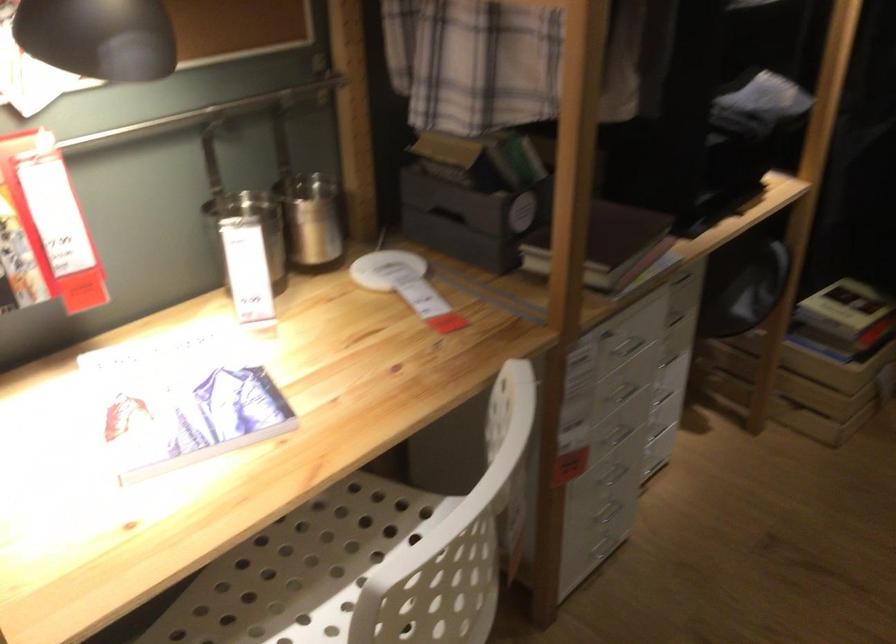
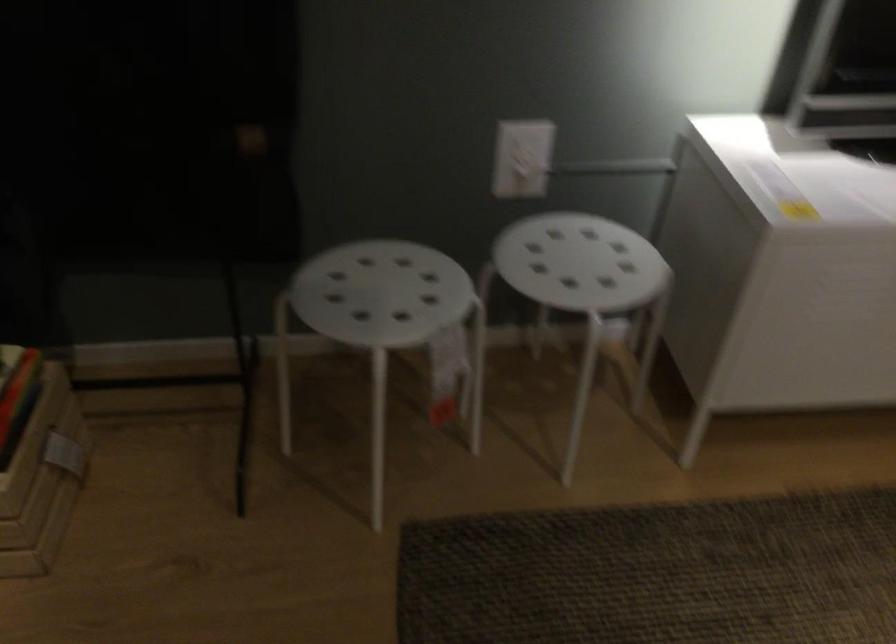
Question: The camera is either moving clockwise (left) or counter-clockwise (right) around the object. The first image is from the beginning of the video and the second image is from the end. Is the camera moving left or right when shooting the video?

Choices:
 (A) Left
 (B) Right

Answer: (A)